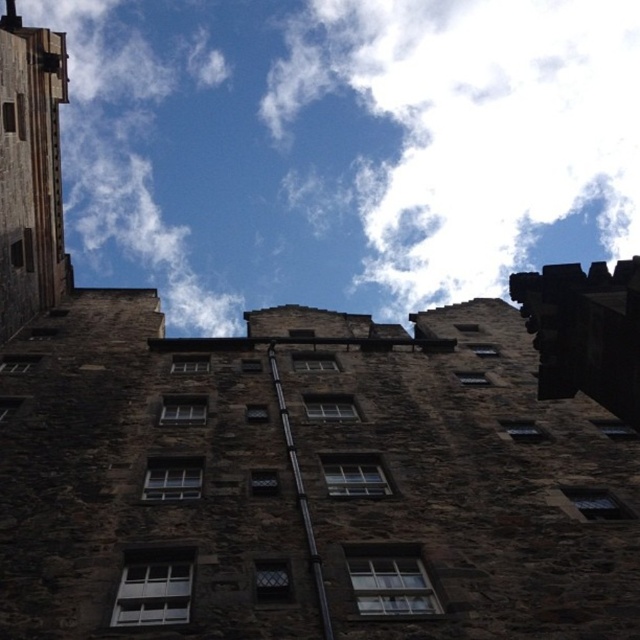
Question: Considering the relative positions of white fluffy cloud at upper center and dark stone tower at left in the image provided, where is white fluffy cloud at upper center located with respect to dark stone tower at left?

Choices:
 (A) below
 (B) above

Answer: (B)

Question: Which point appears farthest from the camera in this image?

Choices:
 (A) [186, 182]
 (B) [12, 301]

Answer: (A)

Question: Which of the following is the farthest from the observer?

Choices:
 (A) (12, 97)
 (B) (545, 176)

Answer: (B)

Question: Does white fluffy cloud at upper center appear under dark stone tower at left?

Choices:
 (A) yes
 (B) no

Answer: (B)

Question: Does white fluffy cloud at upper center have a greater width compared to dark stone tower at left?

Choices:
 (A) yes
 (B) no

Answer: (A)

Question: Which point is closer to the camera?

Choices:
 (A) (1, 280)
 (B) (464, 28)

Answer: (A)